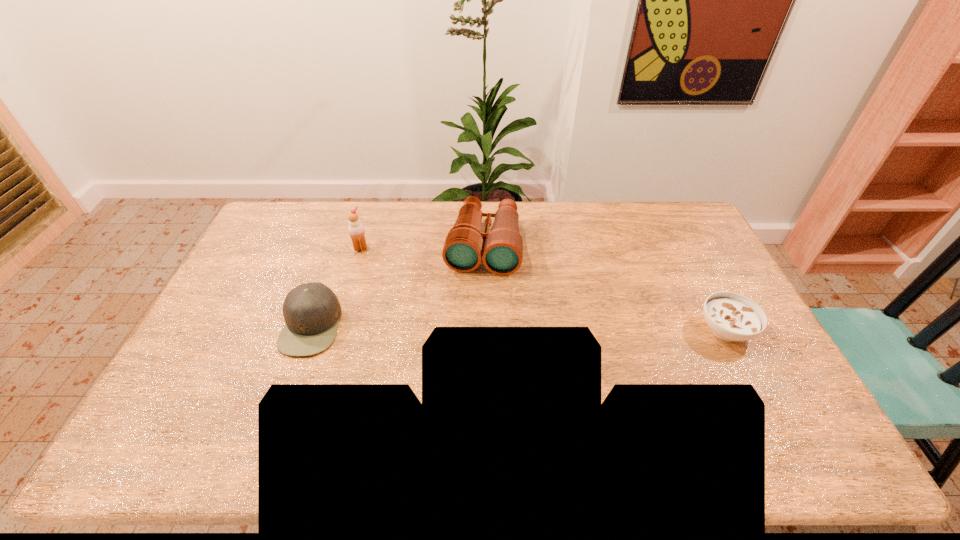
Find the location of a particular element. The height and width of the screenshot is (540, 960). vacant spot on the desktop that is between the cap and the rightmost object and is positioned through the lenses of the second object from right to left is located at coordinates (470, 327).

Identify the location of vacant space on the desktop that is between the third tallest object and the rightmost object and is positioned at the front with a straw on the icecream. (472, 327).